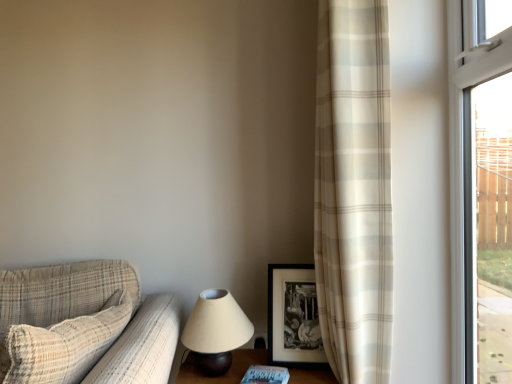
Question: Does matte beige lampshade at lower center have a greater width compared to black matte picture frame at center-right?

Choices:
 (A) yes
 (B) no

Answer: (A)

Question: Is matte beige lampshade at lower center bigger than black matte picture frame at center-right?

Choices:
 (A) no
 (B) yes

Answer: (B)

Question: Is matte beige lampshade at lower center facing towards black matte picture frame at center-right?

Choices:
 (A) yes
 (B) no

Answer: (B)

Question: Is the depth of matte beige lampshade at lower center greater than that of black matte picture frame at center-right?

Choices:
 (A) no
 (B) yes

Answer: (A)

Question: From the image's perspective, is matte beige lampshade at lower center above black matte picture frame at center-right?

Choices:
 (A) no
 (B) yes

Answer: (A)

Question: Is matte beige lampshade at lower center positioned with its back to black matte picture frame at center-right?

Choices:
 (A) no
 (B) yes

Answer: (A)

Question: Is black matte picture frame at center-right outside of matte beige lampshade at lower center?

Choices:
 (A) yes
 (B) no

Answer: (A)

Question: Can you confirm if black matte picture frame at center-right is taller than matte beige lampshade at lower center?

Choices:
 (A) yes
 (B) no

Answer: (A)

Question: Are black matte picture frame at center-right and matte beige lampshade at lower center making contact?

Choices:
 (A) no
 (B) yes

Answer: (A)

Question: Does black matte picture frame at center-right appear on the right side of matte beige lampshade at lower center?

Choices:
 (A) yes
 (B) no

Answer: (A)

Question: From a real-world perspective, is black matte picture frame at center-right physically below matte beige lampshade at lower center?

Choices:
 (A) yes
 (B) no

Answer: (B)

Question: Does black matte picture frame at center-right turn towards matte beige lampshade at lower center?

Choices:
 (A) yes
 (B) no

Answer: (B)

Question: Would you say white matte book at lower center is part of matte beige lampshade at lower center's contents?

Choices:
 (A) no
 (B) yes

Answer: (A)